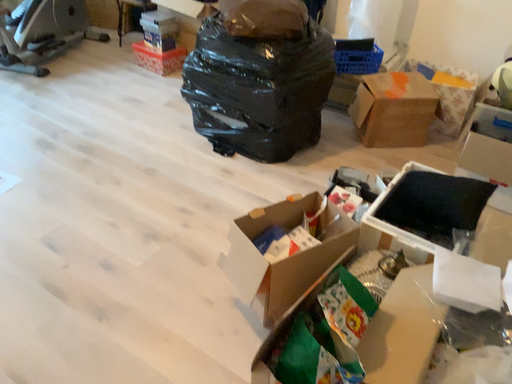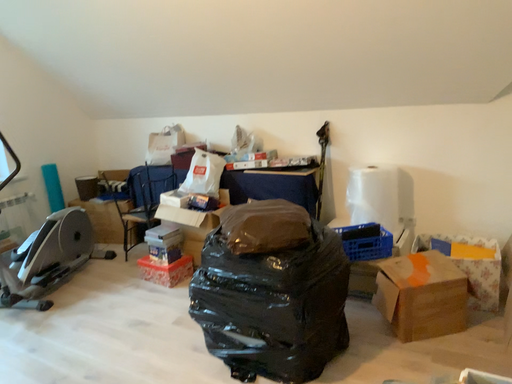
Question: Which way did the camera rotate in the video?

Choices:
 (A) rotated upward
 (B) rotated downward

Answer: (A)